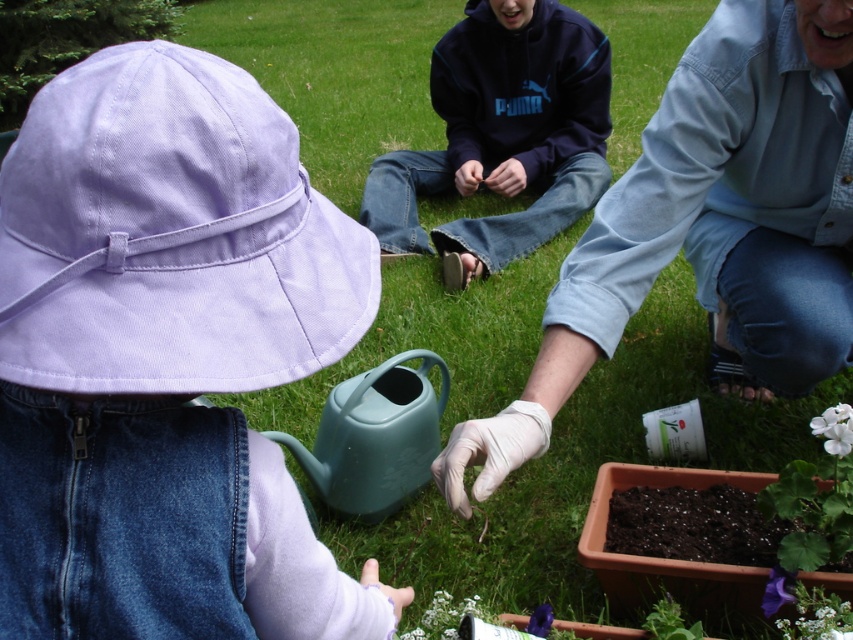
From the picture: Can you confirm if navy blue hoodie at upper center is bigger than purple matte flower at lower right?

Yes.

Measure the distance between navy blue hoodie at upper center and purple matte flower at lower right.

The distance of navy blue hoodie at upper center from purple matte flower at lower right is 6.59 feet.

Who is more distant from viewer, [587,200] or [769,577]?

The point [587,200] is more distant.

This screenshot has width=853, height=640. What are the coordinates of `navy blue hoodie at upper center` in the screenshot? It's located at (502, 136).

You are a GUI agent. You are given a task and a screenshot of the screen. Output one action in this format:
    pyautogui.click(x=<x>, y=<y>)
    Task: Click on the white matte flower at lower right
    This screenshot has width=853, height=640.
    Given the screenshot: What is the action you would take?
    pyautogui.click(x=834, y=428)

Does white matte flower at lower right have a larger size compared to purple matte flower at lower center?

Yes.

Between point (834, 413) and point (541, 609), which one is positioned behind?

The point (834, 413) is more distant.

Find the location of a particular element. The image size is (853, 640). white matte flower at lower right is located at coordinates (834, 428).

Based on the photo, is lavender cotton hat at upper left wider than purple matte flower at lower center?

Yes, lavender cotton hat at upper left is wider than purple matte flower at lower center.

In the scene shown: Between lavender cotton hat at upper left and purple matte flower at lower center, which one is positioned lower?

purple matte flower at lower center is below.

Is point (216, 81) farther from camera compared to point (546, 618)?

No, (216, 81) is in front of (546, 618).

Where is `lavender cotton hat at upper left`? lavender cotton hat at upper left is located at coordinates [170, 236].